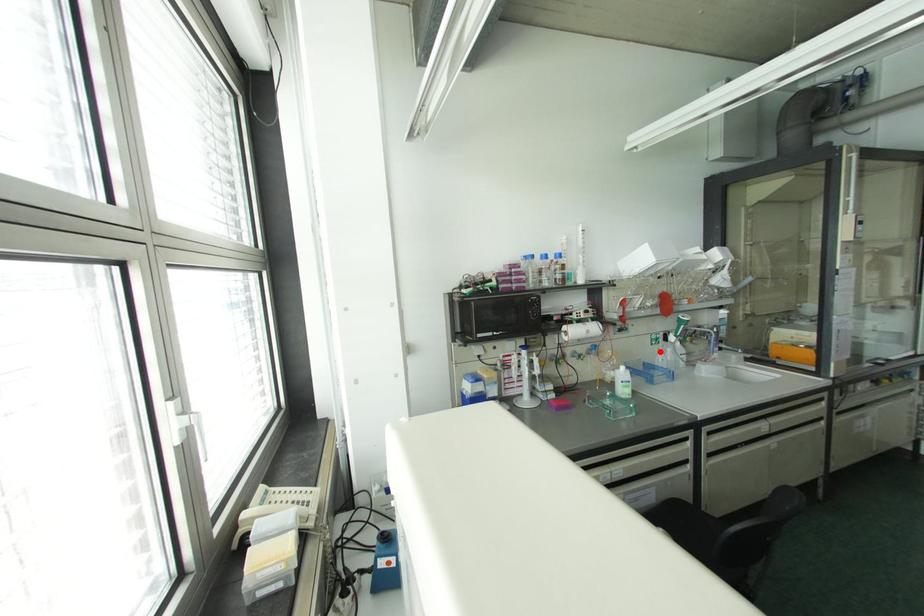
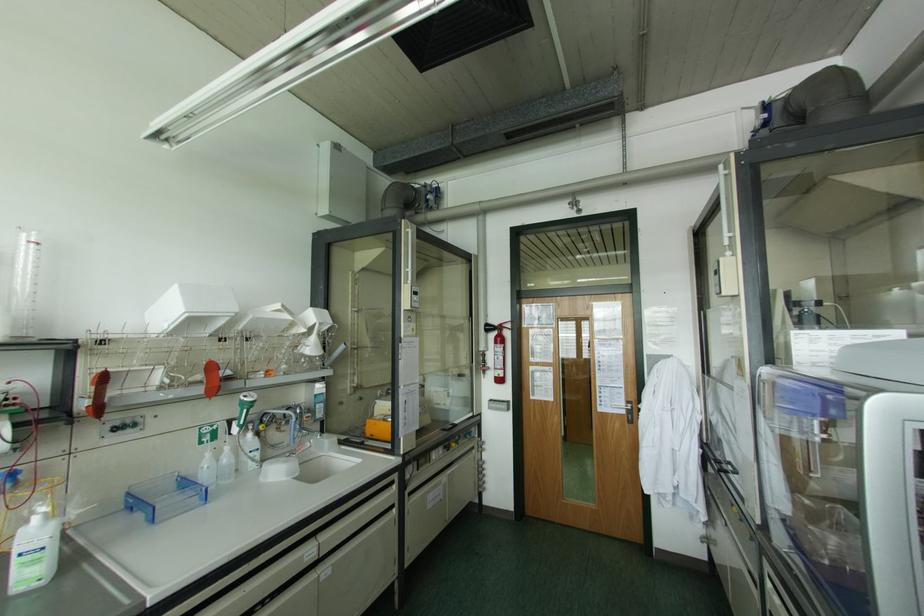
The point at the highlighted location is marked in the first image. Where is the corresponding point in the second image?

(208, 454)